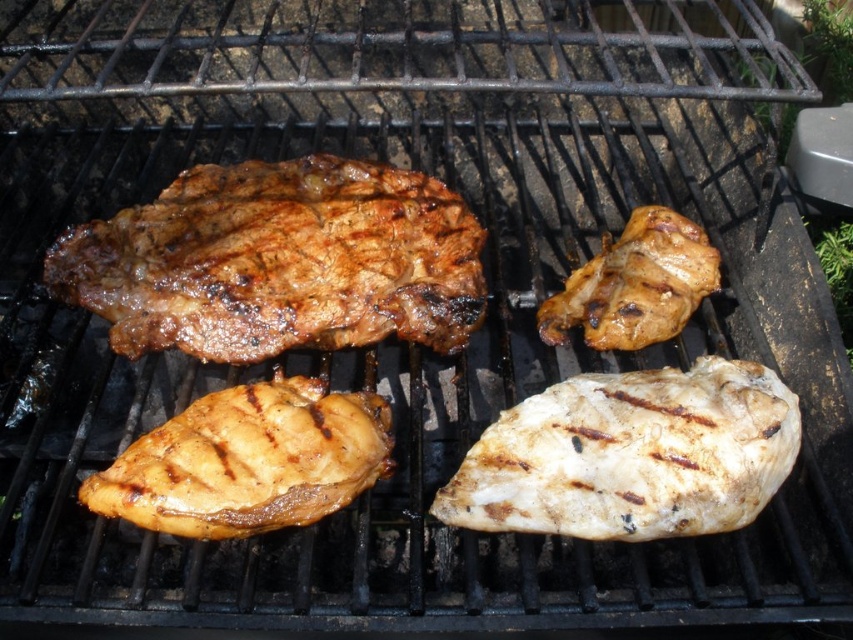
Question: Is golden-brown glazed chicken breast at lower left below brown matte chicken at upper right?

Choices:
 (A) no
 (B) yes

Answer: (B)

Question: Among these objects, which one is farthest from the camera?

Choices:
 (A) grilled brown steak at upper left
 (B) golden-brown glazed chicken breast at lower left
 (C) brown matte chicken at upper right

Answer: (C)

Question: Is white matte chicken breast at center wider than brown matte chicken at upper right?

Choices:
 (A) yes
 (B) no

Answer: (A)

Question: Is golden-brown glazed chicken breast at lower left thinner than brown matte chicken at upper right?

Choices:
 (A) yes
 (B) no

Answer: (B)

Question: Among these objects, which one is farthest from the camera?

Choices:
 (A) grilled brown steak at upper left
 (B) golden-brown glazed chicken breast at lower left
 (C) white matte chicken breast at center

Answer: (A)

Question: Estimate the real-world distances between objects in this image. Which object is closer to the white matte chicken breast at center?

Choices:
 (A) golden-brown glazed chicken breast at lower left
 (B) brown matte chicken at upper right
 (C) grilled brown steak at upper left

Answer: (B)